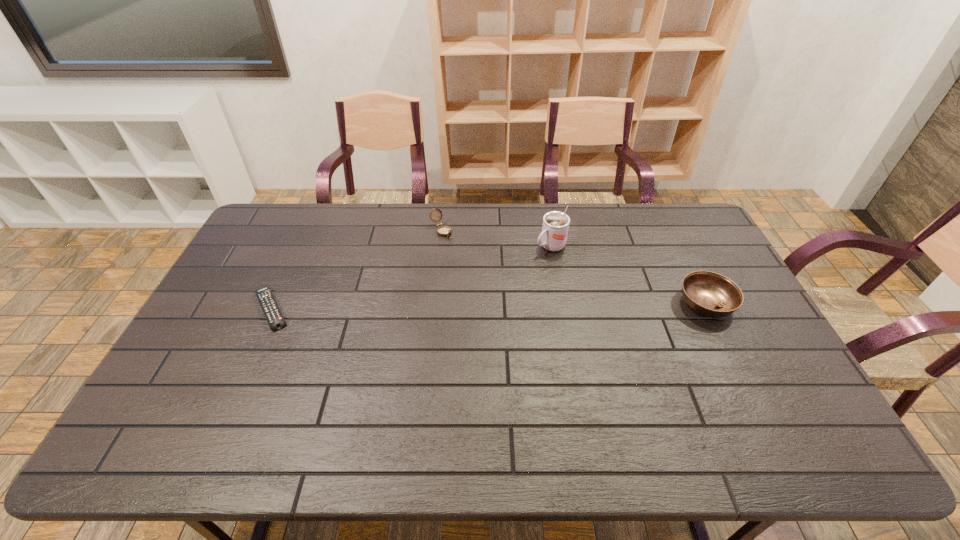
Where is `free region at the left edge of the desktop`? This screenshot has width=960, height=540. free region at the left edge of the desktop is located at coordinates (245, 269).

Find the location of `vacant space at the right edge of the desktop`. vacant space at the right edge of the desktop is located at coordinates (684, 248).

Image resolution: width=960 pixels, height=540 pixels. I want to click on vacant point at the far right corner, so click(x=666, y=224).

At what (x,y) coordinates should I click in order to perform the action: click on vacant space at the near right corner of the desktop. Please return your answer as a coordinate pair (x, y). The image size is (960, 540). Looking at the image, I should click on (747, 389).

In order to click on empty space that is in between the compass and the cup in this screenshot , I will do `click(495, 239)`.

Where is `free spot between the third object from left to right and the rightmost object`? The width and height of the screenshot is (960, 540). free spot between the third object from left to right and the rightmost object is located at coordinates (628, 275).

This screenshot has width=960, height=540. I want to click on vacant space in between the soup bowl and the second object from right to left, so click(628, 275).

Where is `free space between the remote control and the soup bowl`? free space between the remote control and the soup bowl is located at coordinates (489, 306).

You are a GUI agent. You are given a task and a screenshot of the screen. Output one action in this format:
    pyautogui.click(x=<x>, y=<y>)
    Task: Click on the vacant space that is in between the compass and the tallest object
    
    Given the screenshot: What is the action you would take?
    pyautogui.click(x=495, y=239)

Identify the location of empty location between the compass and the second object from right to left. This screenshot has height=540, width=960. (495, 239).